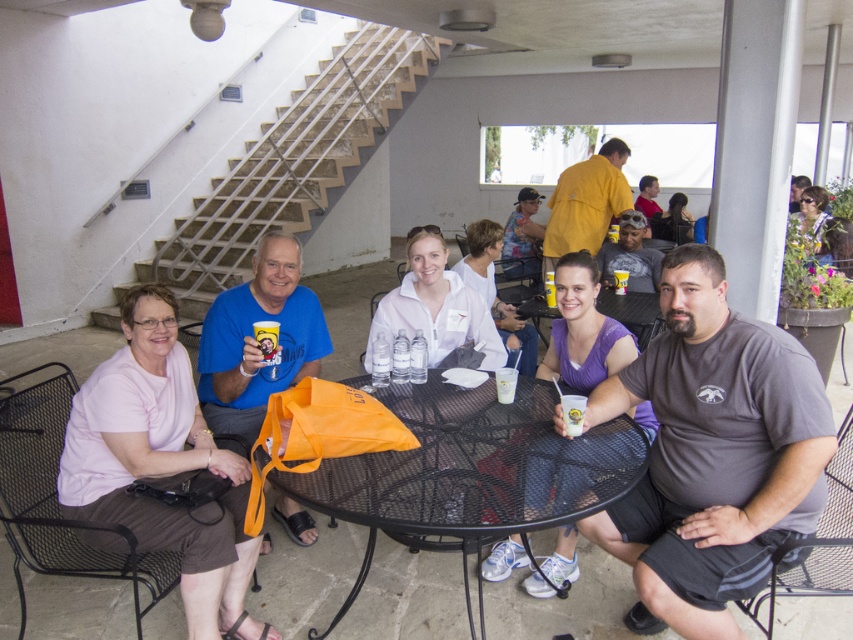
You are a photographer standing in front of the black mesh table at center and the orange fabric bag at center. Which object is nearer to you?

The black mesh table at center is closer to the viewer than the orange fabric bag at center.